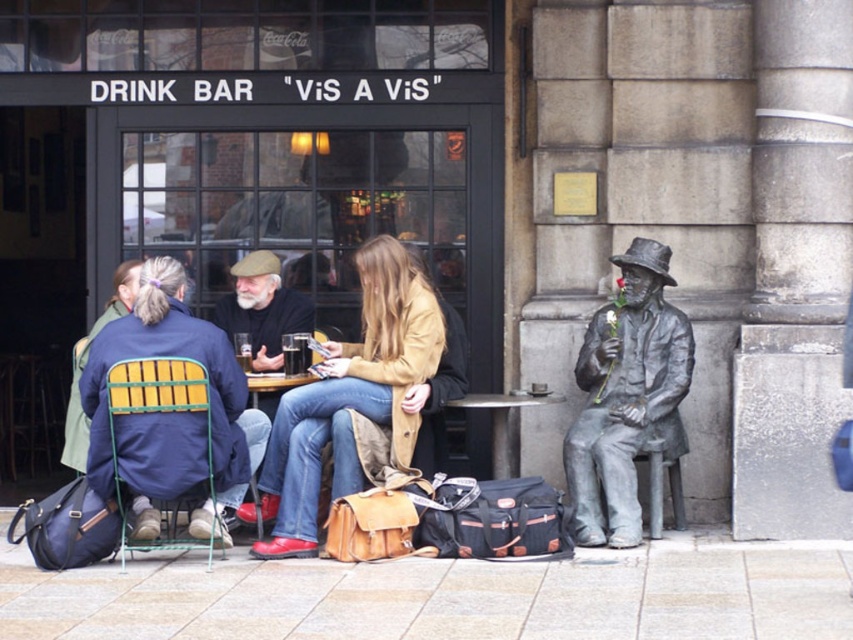
This screenshot has width=853, height=640. What do you see at coordinates (625, 397) in the screenshot?
I see `bronze statue at right` at bounding box center [625, 397].

Is point (635, 284) behind point (270, 273)?

No.

Which is in front, point (672, 401) or point (309, 310)?

Point (672, 401) is in front.

At what (x,y) coordinates should I click in order to perform the action: click on bronze statue at right. Please return your answer as a coordinate pair (x, y). Image resolution: width=853 pixels, height=640 pixels. Looking at the image, I should click on (625, 397).

Consider the image. Is the position of tan leather jacket at center more distant than that of matte blue jacket at center?

Yes.

Between tan leather jacket at center and matte blue jacket at center, which one appears on the left side from the viewer's perspective?

→ From the viewer's perspective, matte blue jacket at center appears more on the left side.

Between point (323, 442) and point (154, 355), which one is positioned behind?

Point (323, 442)

The image size is (853, 640). What are the coordinates of `tan leather jacket at center` in the screenshot? It's located at (351, 397).

Can you confirm if brown leather jacket at center is thinner than matte black cup at center?

In fact, brown leather jacket at center might be wider than matte black cup at center.

Based on the photo, does brown leather jacket at center have a lesser height compared to matte black cup at center?

No, brown leather jacket at center is not shorter than matte black cup at center.

Is point (285, 296) positioned before point (297, 355)?

That is False.

This screenshot has width=853, height=640. I want to click on brown leather jacket at center, so click(x=262, y=308).